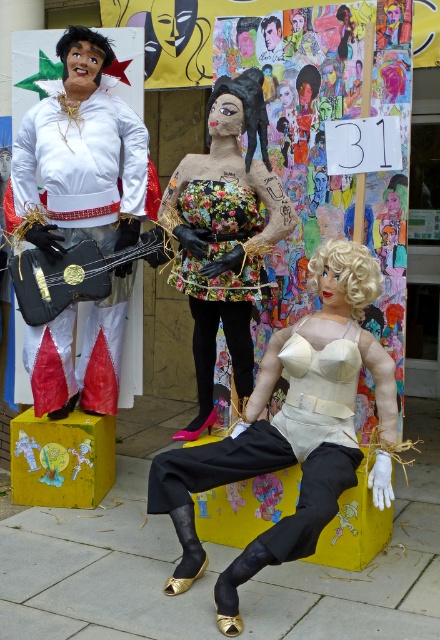
Can you confirm if matte beige bust at center is thinner than floral fabric dress at center?

No, matte beige bust at center is not thinner than floral fabric dress at center.

Does point (333, 339) lie behind point (205, 304)?

That is False.

Locate an element on the screen. matte beige bust at center is located at coordinates (289, 429).

Identify the location of matte beige bust at center. (289, 429).

Which is below, matte beige bust at center or blonde synthetic wig at center?

Positioned lower is matte beige bust at center.

Is matte beige bust at center smaller than blonde synthetic wig at center?

Incorrect, matte beige bust at center is not smaller in size than blonde synthetic wig at center.

Which is behind, point (351, 376) or point (360, 310)?

Positioned behind is point (360, 310).

Find the location of `matte beige bust at center`. matte beige bust at center is located at coordinates (289, 429).

Between point (208, 385) and point (312, 289), which one is positioned behind?

The point (208, 385) is behind.

What do you see at coordinates (224, 234) in the screenshot?
I see `floral fabric dress at center` at bounding box center [224, 234].

Where is `floral fabric dress at center`? floral fabric dress at center is located at coordinates (224, 234).